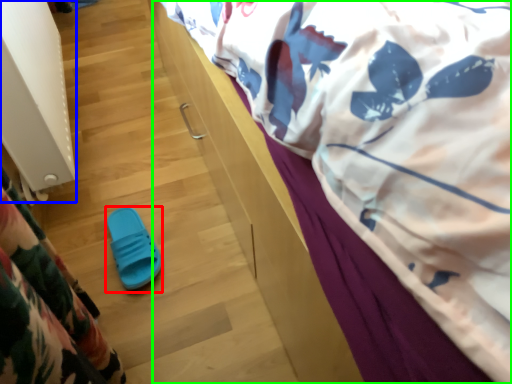
Question: Which object is the closest to the footwear (highlighted by a red box)? Choose among these: radiator (highlighted by a blue box) or bed (highlighted by a green box).

Choices:
 (A) radiator
 (B) bed

Answer: (A)